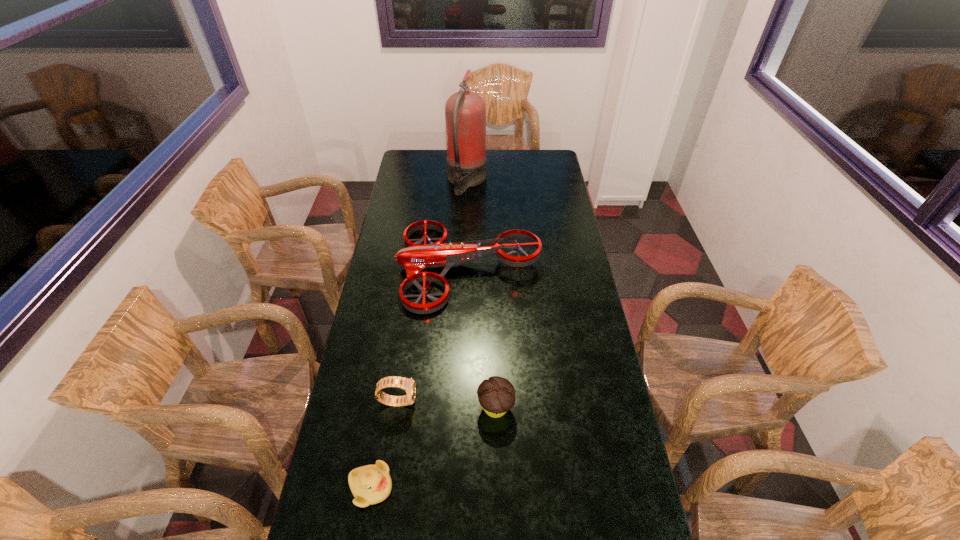
Locate an element on the screen. This screenshot has width=960, height=540. vacant region located 0.050m on the back of the muffin is located at coordinates (494, 377).

Locate an element on the screen. This screenshot has width=960, height=540. vacant space located on the front-facing side of the duckling is located at coordinates (489, 487).

Where is `object at the far edge`? object at the far edge is located at coordinates (465, 113).

Find the location of a particular element. The width and height of the screenshot is (960, 540). drone that is at the left edge is located at coordinates (416, 257).

This screenshot has width=960, height=540. In order to click on watch that is positioned at the left edge in this screenshot , I will do `click(408, 385)`.

This screenshot has width=960, height=540. Identify the location of duckling present at the left edge. (371, 484).

This screenshot has height=540, width=960. In the image, there is a desktop. What are the coordinates of `vacant space at the left edge` in the screenshot? It's located at [x=410, y=184].

This screenshot has width=960, height=540. I want to click on vacant area at the right edge, so click(588, 321).

I want to click on free space at the far right corner of the desktop, so click(x=555, y=171).

Image resolution: width=960 pixels, height=540 pixels. I want to click on free spot between the farthest object and the duckling, so click(x=419, y=334).